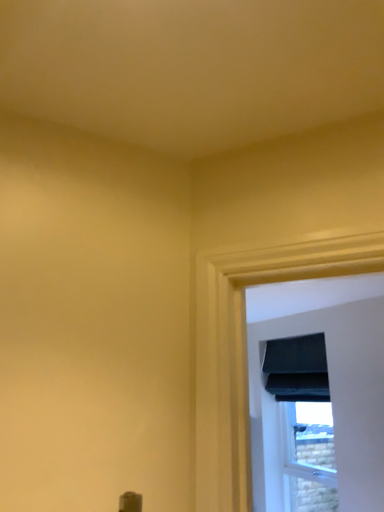
This screenshot has height=512, width=384. What do you see at coordinates (309, 456) in the screenshot? I see `matte black window at upper right` at bounding box center [309, 456].

Measure the distance between matte black window at upper right and camera.

matte black window at upper right and camera are 3.52 meters apart.

What is the approximate height of matte black window at upper right?

39.02 inches.

Where is `matte black window at upper right`? The image size is (384, 512). matte black window at upper right is located at coordinates (309, 456).

You are a GUI agent. You are given a task and a screenshot of the screen. Output one action in this format:
    pyautogui.click(x=<x>, y=<y>)
    Task: Click on the matte black window at upper right
    
    Given the screenshot: What is the action you would take?
    pyautogui.click(x=309, y=456)